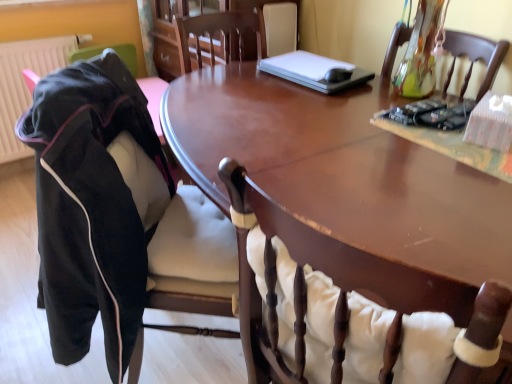
You are a GUI agent. You are given a task and a screenshot of the screen. Output one action in this format:
    pyautogui.click(x=<x>, y=<y>)
    Task: Click on the glossy wood table at center
    This screenshot has width=512, height=384.
    Given the screenshot: What is the action you would take?
    pyautogui.click(x=341, y=170)

Locate an element on the screen. This screenshot has height=384, width=512. suede-like black jacket at left, arranged as the first chair when viewed from the left is located at coordinates (100, 208).

This screenshot has height=384, width=512. Identify the location of wooden chair at center, the first chair positioned from the right. (346, 312).

Does point (126, 360) come behind point (338, 81)?

That is False.

From their relative heights in the image, would you say suede-like black jacket at left, arranged as the first chair when viewed from the left, is taller or shorter than white plastic laptop at upper center?

In the image, suede-like black jacket at left, arranged as the first chair when viewed from the left, appears to be taller than white plastic laptop at upper center.

Are suede-like black jacket at left, arranged as the first chair when viewed from the left, and white plastic laptop at upper center beside each other?

suede-like black jacket at left, arranged as the first chair when viewed from the left, is not next to white plastic laptop at upper center, and they're not touching.

How distant is white plastic laptop at upper center from glossy wood table at center?

white plastic laptop at upper center is 12.99 inches away from glossy wood table at center.

In order to click on laptop located on the left of glossy wood table at center in this screenshot , I will do `click(315, 71)`.

Is white plastic laptop at upper center shorter than glossy wood table at center?

Indeed, white plastic laptop at upper center has a lesser height compared to glossy wood table at center.

From a real-world perspective, between white plastic laptop at upper center and glossy wood table at center, who is vertically higher?

white plastic laptop at upper center.

From the image's perspective, is wooden chair at center, which ranks as the 2th chair in left-to-right order, located above or below suede-like black jacket at left, arranged as the first chair when viewed from the left?

Clearly, from the image's perspective, wooden chair at center, which ranks as the 2th chair in left-to-right order, is below suede-like black jacket at left, arranged as the first chair when viewed from the left.

Considering the relative sizes of wooden chair at center, which ranks as the 2th chair in left-to-right order, and suede-like black jacket at left, which is the second chair from right to left, in the image provided, is wooden chair at center, which ranks as the 2th chair in left-to-right order, wider than suede-like black jacket at left, which is the second chair from right to left,?

No.

Considering the positions of objects wooden chair at center, which ranks as the 2th chair in left-to-right order, and suede-like black jacket at left, arranged as the first chair when viewed from the left, in the image provided, who is more to the left, wooden chair at center, which ranks as the 2th chair in left-to-right order, or suede-like black jacket at left, arranged as the first chair when viewed from the left,?

suede-like black jacket at left, arranged as the first chair when viewed from the left.

From a real-world perspective, which is physically below, wooden chair at center, the first chair positioned from the right, or suede-like black jacket at left, which is the second chair from right to left?

suede-like black jacket at left, which is the second chair from right to left, is physically lower.

Do you think glossy wood table at center is within matte plastic radiator at left, or outside of it?

glossy wood table at center exists outside the volume of matte plastic radiator at left.

Locate an element on the screen. table top below the matte plastic radiator at left (from the image's perspective) is located at coordinates (x=341, y=170).

Are glossy wood table at center and matte plastic radiator at left making contact?

No, glossy wood table at center is not with matte plastic radiator at left.

Considering the relative positions of glossy wood table at center and matte plastic radiator at left in the image provided, is glossy wood table at center to the left or to the right of matte plastic radiator at left?

Clearly, glossy wood table at center is on the right of matte plastic radiator at left in the image.

Is suede-like black jacket at left, which is the second chair from right to left, directly adjacent to glossy wood table at center?

suede-like black jacket at left, which is the second chair from right to left, and glossy wood table at center are not in contact.

Can you confirm if suede-like black jacket at left, arranged as the first chair when viewed from the left, is wider than glossy wood table at center?

No, suede-like black jacket at left, arranged as the first chair when viewed from the left, is not wider than glossy wood table at center.

Which object is positioned more to the left, suede-like black jacket at left, which is the second chair from right to left, or glossy wood table at center?

suede-like black jacket at left, which is the second chair from right to left.

Does point (181, 231) come closer to viewer compared to point (437, 255)?

That is False.

Which object is wider, wooden chair at center, which ranks as the 2th chair in left-to-right order, or matte plastic radiator at left?

With larger width is wooden chair at center, which ranks as the 2th chair in left-to-right order.

Is wooden chair at center, which ranks as the 2th chair in left-to-right order, located outside matte plastic radiator at left?

Yes.

What's the angular difference between wooden chair at center, the first chair positioned from the right, and matte plastic radiator at left's facing directions?

wooden chair at center, the first chair positioned from the right, and matte plastic radiator at left are facing 96.7 degrees away from each other.

Who is more distant, wooden chair at center, which ranks as the 2th chair in left-to-right order, or matte plastic radiator at left?

matte plastic radiator at left is more distant.

Based on their sizes in the image, would you say wooden chair at center, which ranks as the 2th chair in left-to-right order, is bigger or smaller than glossy wood table at center?

Clearly, wooden chair at center, which ranks as the 2th chair in left-to-right order, is smaller in size than glossy wood table at center.

Is point (424, 322) in front of point (385, 243)?

Yes.

You are a GUI agent. You are given a task and a screenshot of the screen. Output one action in this format:
    pyautogui.click(x=<x>, y=<y>)
    Task: Click on the table top lying on the left of wooden chair at center, which ranks as the 2th chair in left-to-right order
    The width and height of the screenshot is (512, 384).
    Given the screenshot: What is the action you would take?
    pyautogui.click(x=341, y=170)

From the image's perspective, between wooden chair at center, which ranks as the 2th chair in left-to-right order, and glossy wood table at center, who is located below?

wooden chair at center, which ranks as the 2th chair in left-to-right order.

Where is `laptop behind the suede-like black jacket at left, which is the second chair from right to left`? This screenshot has height=384, width=512. laptop behind the suede-like black jacket at left, which is the second chair from right to left is located at coordinates (315, 71).

At what (x,y) coordinates should I click in order to perform the action: click on laptop on the left of glossy wood table at center. Please return your answer as a coordinate pair (x, y). The width and height of the screenshot is (512, 384). Looking at the image, I should click on (315, 71).

In the scene shown: Which object lies nearer to the anchor point glossy wood table at center, suede-like black jacket at left, arranged as the first chair when viewed from the left, or white plastic laptop at upper center?

white plastic laptop at upper center lies closer to glossy wood table at center than the other object.

When comparing their distances from suede-like black jacket at left, arranged as the first chair when viewed from the left, does matte plastic radiator at left or wooden chair at center, which ranks as the 2th chair in left-to-right order, seem further?

matte plastic radiator at left lies further to suede-like black jacket at left, arranged as the first chair when viewed from the left, than the other object.

Based on their spatial positions, is glossy wood table at center or wooden chair at center, which ranks as the 2th chair in left-to-right order, further from suede-like black jacket at left, arranged as the first chair when viewed from the left?

Among the two, wooden chair at center, which ranks as the 2th chair in left-to-right order, is located further to suede-like black jacket at left, arranged as the first chair when viewed from the left.

Considering their positions, is wooden chair at center, the first chair positioned from the right, positioned further to glossy wood table at center than white plastic laptop at upper center?

Based on the image, wooden chair at center, the first chair positioned from the right, appears to be further to glossy wood table at center.

Considering their positions, is glossy wood table at center positioned further to matte plastic radiator at left than suede-like black jacket at left, arranged as the first chair when viewed from the left?

Among the two, glossy wood table at center is located further to matte plastic radiator at left.

Which object lies further to the anchor point matte plastic radiator at left, wooden chair at center, the first chair positioned from the right, or white plastic laptop at upper center?

wooden chair at center, the first chair positioned from the right, lies further to matte plastic radiator at left than the other object.

When comparing their distances from suede-like black jacket at left, which is the second chair from right to left, does matte plastic radiator at left or glossy wood table at center seem further?

matte plastic radiator at left is positioned further to the anchor suede-like black jacket at left, which is the second chair from right to left.

Looking at the image, which one is located closer to matte plastic radiator at left, suede-like black jacket at left, arranged as the first chair when viewed from the left, or white plastic laptop at upper center?

Based on the image, white plastic laptop at upper center appears to be nearer to matte plastic radiator at left.

I want to click on chair between glossy wood table at center and white plastic laptop at upper center along the z-axis, so click(x=100, y=208).

Find the location of a particular element. This screenshot has height=384, width=512. chair located between glossy wood table at center and matte plastic radiator at left in the depth direction is located at coordinates (100, 208).

At what (x,y) coordinates should I click in order to perform the action: click on chair positioned between wooden chair at center, the first chair positioned from the right, and matte plastic radiator at left from near to far. Please return your answer as a coordinate pair (x, y). Looking at the image, I should click on (100, 208).

At what (x,y) coordinates should I click in order to perform the action: click on chair between wooden chair at center, the first chair positioned from the right, and white plastic laptop at upper center in the front-back direction. Please return your answer as a coordinate pair (x, y). Looking at the image, I should click on (100, 208).